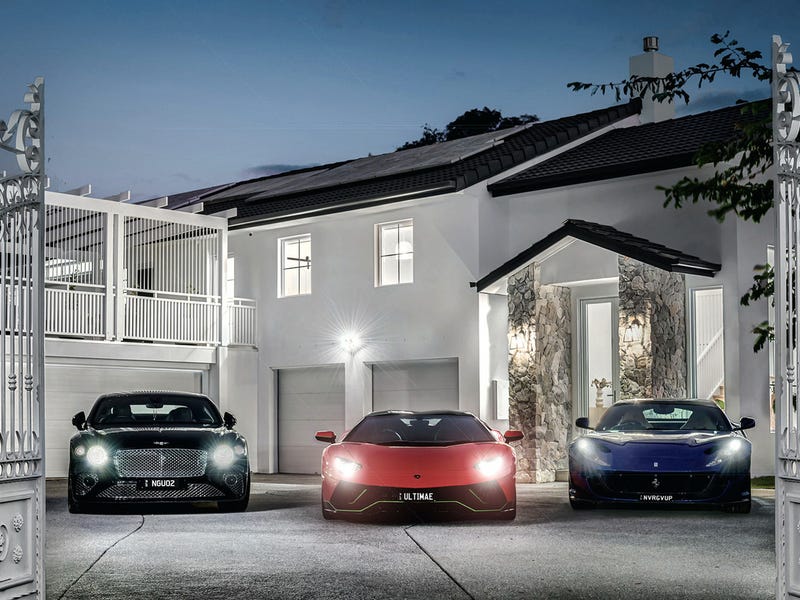
I want to click on inside window vase, so click(x=597, y=394).